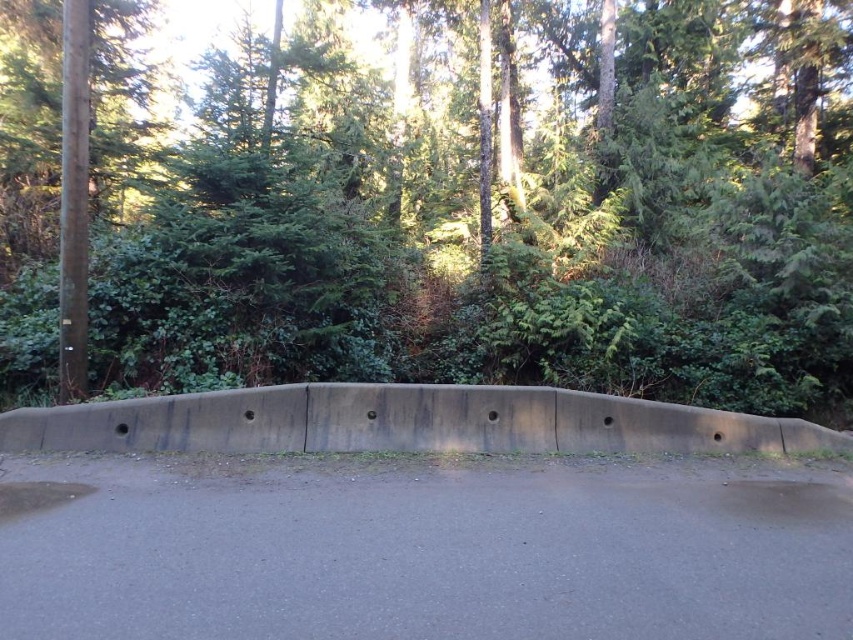
Between green leafy forest at upper center and gray concrete barrier at center, which one appears on the left side from the viewer's perspective?

gray concrete barrier at center

Is green leafy forest at upper center positioned before gray concrete barrier at center?

No, it is behind gray concrete barrier at center.

Measure the distance between green leafy forest at upper center and camera.

green leafy forest at upper center is 4.06 meters from camera.

The height and width of the screenshot is (640, 853). What are the coordinates of `green leafy forest at upper center` in the screenshot? It's located at (497, 220).